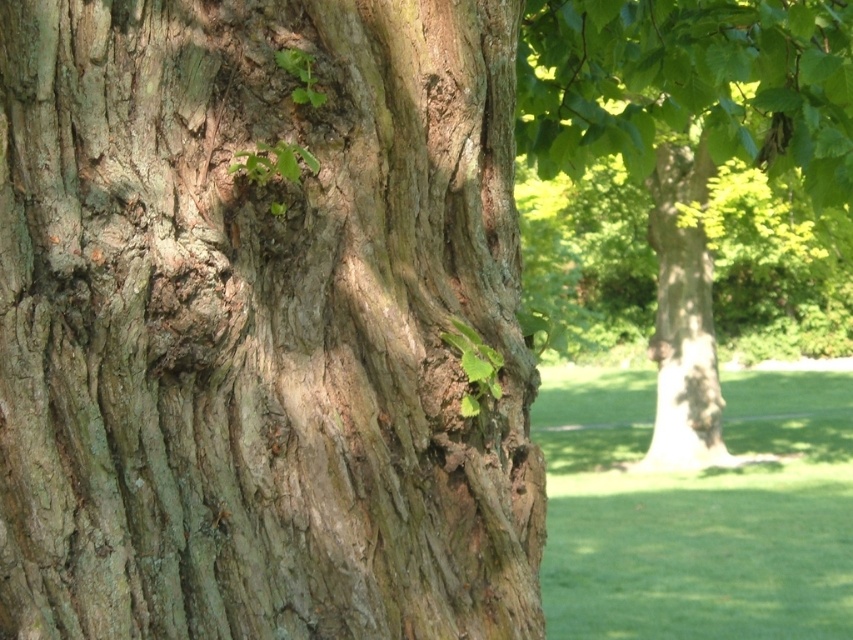
Question: Is green grass at lower right thinner than green leafy tree at center?

Choices:
 (A) no
 (B) yes

Answer: (A)

Question: Among these points, which one is nearest to the camera?

Choices:
 (A) (556, 401)
 (B) (436, 204)
 (C) (670, 220)
 (D) (674, 426)

Answer: (B)

Question: Among these objects, which one is nearest to the camera?

Choices:
 (A) smooth brown tree trunk at right
 (B) green leafy tree at center
 (C) green grass at lower right

Answer: (C)

Question: Is green grass at lower right thinner than smooth brown tree trunk at right?

Choices:
 (A) no
 (B) yes

Answer: (A)

Question: Is green grass at lower right below green leafy tree at center?

Choices:
 (A) no
 (B) yes

Answer: (B)

Question: Which of the following is the farthest from the observer?

Choices:
 (A) green leafy tree at center
 (B) smooth brown tree trunk at right
 (C) greenish-brown bark at center

Answer: (B)